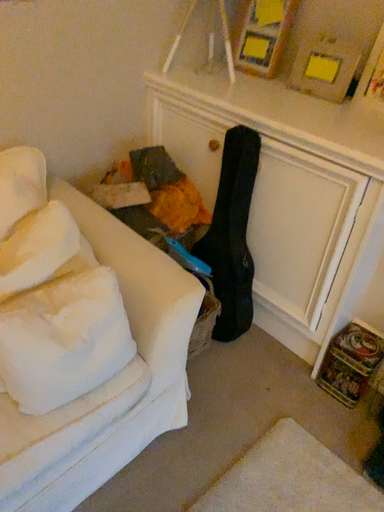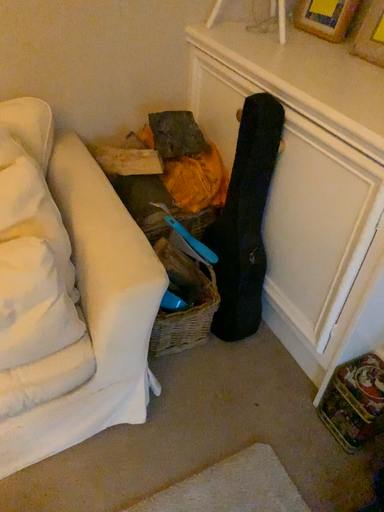
Question: Which way did the camera rotate in the video?

Choices:
 (A) rotated left
 (B) rotated right

Answer: (A)